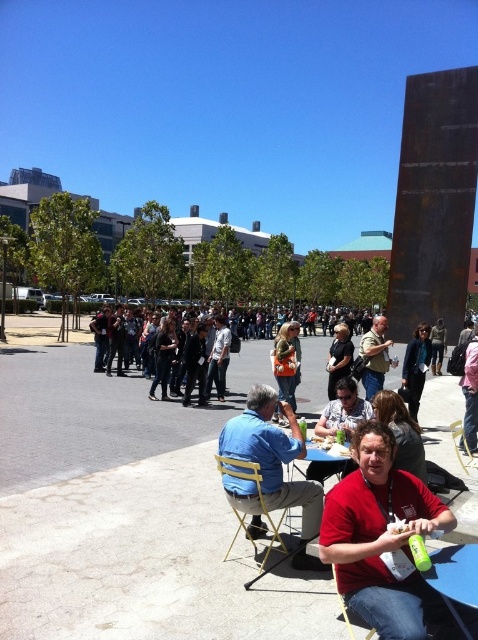
Who is higher up, dark blue suit at center or yellow plastic chair at lower right?

dark blue suit at center is higher up.

Does dark blue suit at center appear on the right side of yellow plastic chair at lower right?

Yes, dark blue suit at center is to the right of yellow plastic chair at lower right.

Does point (406, 356) come behind point (477, 456)?

Yes, point (406, 356) is farther from viewer.

Find the location of a particular element. dark blue suit at center is located at coordinates (415, 369).

Is matte black jacket at center to the left of dark gray shirt at center from the viewer's perspective?

Indeed, matte black jacket at center is positioned on the left side of dark gray shirt at center.

Does point (422, 481) come closer to viewer compared to point (350, 348)?

Yes, it is.

This screenshot has height=640, width=478. What are the coordinates of `matte black jacket at center` in the screenshot? It's located at (401, 433).

Between blue denim shirt at center and blue plastic table at lower right, which one is positioned higher?

blue plastic table at lower right is above.

Can you confirm if blue denim shirt at center is taller than blue plastic table at lower right?

Yes, blue denim shirt at center is taller than blue plastic table at lower right.

Is point (253, 520) positioned before point (441, 576)?

No, (253, 520) is behind (441, 576).

Locate an element on the screen. The image size is (478, 640). blue denim shirt at center is located at coordinates (272, 456).